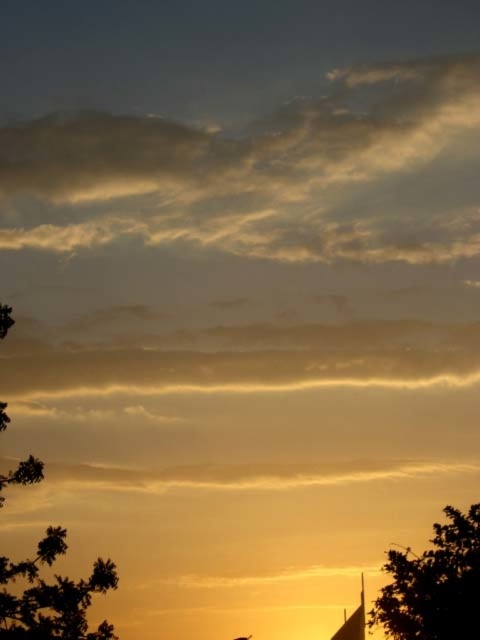
Looking at this image, you are standing at the center of the image and want to walk towards the green leafy tree at lower right. In which direction should you move?

You should move towards the lower right direction to reach the green leafy tree at lower right since it is located at point [433,582].

You are an artist trying to paint the sunset scene. You want to ensure the trees are proportionally accurate. Which tree should you paint larger, the green leafy tree at lower right or the dark green leafy tree at left?

The green leafy tree at lower right should be painted larger than the dark green leafy tree at left because it is larger in size according to the description.

You are standing in the sunset scene and want to find the point at coordinate (433,582). Which object in the scene is this point located on?

The point at coordinate (433,582) is located on the green leafy tree at lower right.